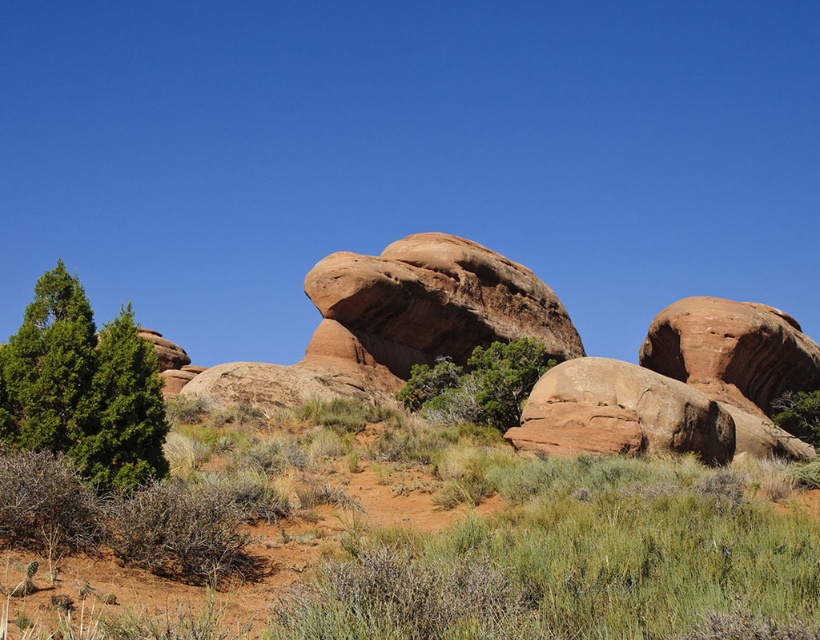
Looking at this image, you are a hiker standing at the base of the rustic sandstone rock at center and the green leafy tree at center. Which object would you need to look up higher to see the top of?

The rustic sandstone rock at center is taller than the green leafy tree at center, so you would need to look up higher to see the top of the rustic sandstone rock at center.

You are standing at the center of the image and want to walk towards the green shrubbery at lower left. In which direction should you head?

Since the green shrubbery at lower left is located at point (406, 538), you should head towards the lower left direction to reach it.

You are standing at the base of the rock formations and want to take a photo that includes both point (632, 580) and point (126, 470). Which point should you focus on first to ensure both are in sharp focus?

You should focus on point (632, 580) first because it is closer to the camera than point (126, 470), ensuring the depth of field captures both points clearly.